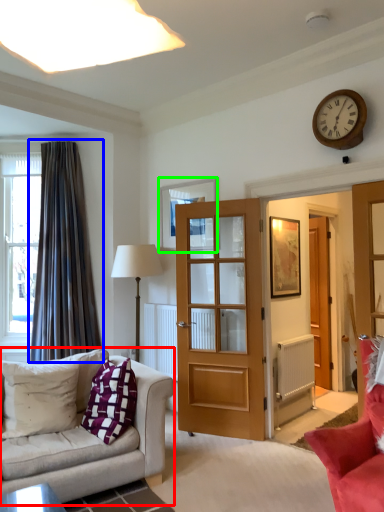
Question: Which object is positioned farthest from studio couch (highlighted by a red box)? Select from curtain (highlighted by a blue box) and picture frame (highlighted by a green box).

Choices:
 (A) curtain
 (B) picture frame

Answer: (B)